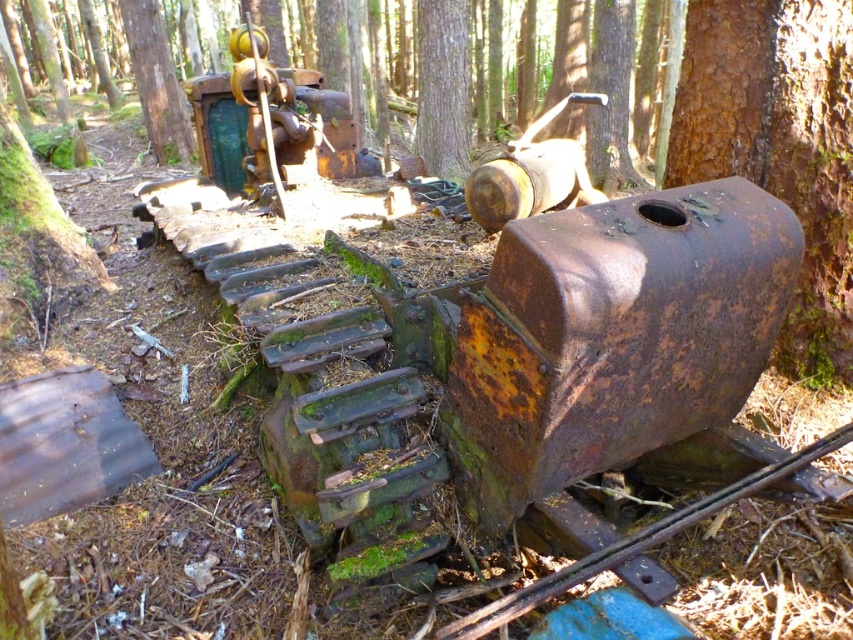
Question: Which point is closer to the camera?

Choices:
 (A) (416, 148)
 (B) (152, 3)

Answer: (A)

Question: Does smooth brown tree trunk at center have a larger size compared to green mossy tree at upper center?

Choices:
 (A) yes
 (B) no

Answer: (A)

Question: Among these objects, which one is nearest to the camera?

Choices:
 (A) smooth brown tree trunk at center
 (B) green mossy tree at upper center

Answer: (A)

Question: Among these objects, which one is farthest from the camera?

Choices:
 (A) green mossy tree at upper center
 (B) smooth brown tree trunk at center

Answer: (A)

Question: From the image, what is the correct spatial relationship of smooth brown tree trunk at center in relation to green mossy tree at upper center?

Choices:
 (A) above
 (B) below

Answer: (B)

Question: Can you confirm if smooth brown tree trunk at center is smaller than green mossy tree at upper center?

Choices:
 (A) yes
 (B) no

Answer: (B)